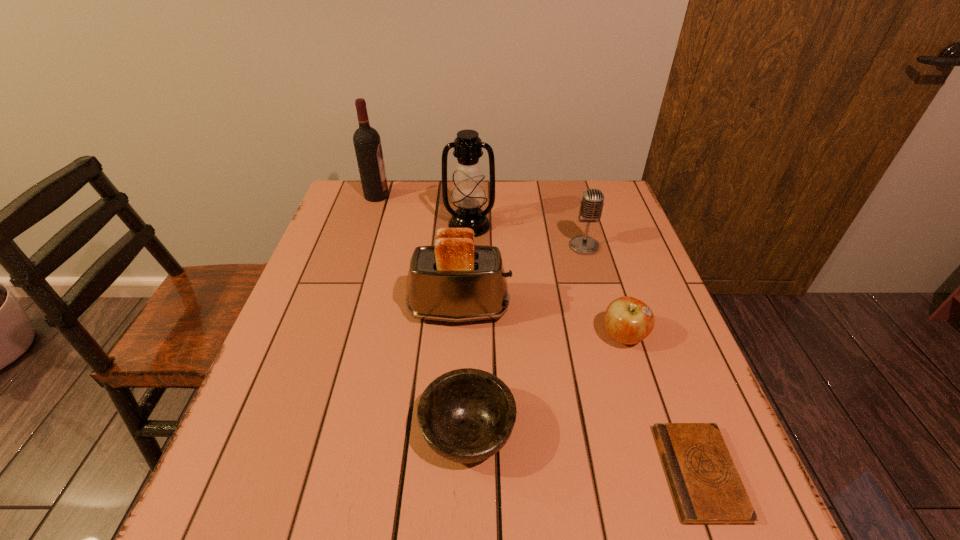
Image resolution: width=960 pixels, height=540 pixels. I want to click on the farthest object, so click(x=367, y=143).

This screenshot has height=540, width=960. Identify the location of wine bottle. (367, 143).

The image size is (960, 540). Identify the location of oil lamp. (468, 192).

Where is `toaster`? The height and width of the screenshot is (540, 960). toaster is located at coordinates (454, 280).

Find the location of a particular element. microphone is located at coordinates (591, 206).

Locate an element on the screen. The width and height of the screenshot is (960, 540). the fifth tallest object is located at coordinates (628, 320).

The width and height of the screenshot is (960, 540). Identify the location of the second shortest object. (467, 415).

At what (x,y) coordinates should I click in order to perform the action: click on diary. Please return your answer as a coordinate pair (x, y). Looking at the image, I should click on (707, 488).

Locate an element on the screen. This screenshot has width=960, height=540. blank area located on the label of the leftmost object is located at coordinates click(x=514, y=196).

Find the location of a particular element. The height and width of the screenshot is (540, 960). vacant space located 0.230m on the front of the oil lamp is located at coordinates (468, 294).